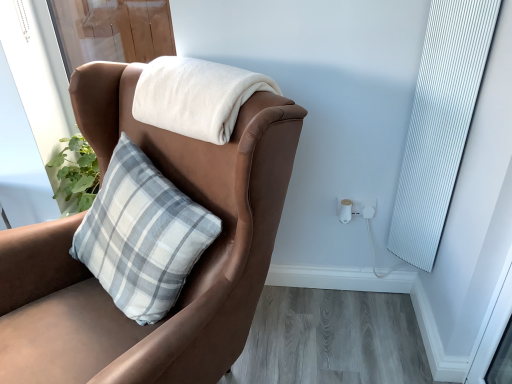
Question: Considering the relative sizes of white soft blanket at upper center and white plastic electric outlet at lower right in the image provided, is white soft blanket at upper center thinner than white plastic electric outlet at lower right?

Choices:
 (A) yes
 (B) no

Answer: (B)

Question: Is white soft blanket at upper center aimed at white plastic electric outlet at lower right?

Choices:
 (A) no
 (B) yes

Answer: (A)

Question: Considering the relative sizes of white soft blanket at upper center and white plastic electric outlet at lower right in the image provided, is white soft blanket at upper center shorter than white plastic electric outlet at lower right?

Choices:
 (A) yes
 (B) no

Answer: (B)

Question: Would you say white soft blanket at upper center contains white plastic electric outlet at lower right?

Choices:
 (A) yes
 (B) no

Answer: (B)

Question: From the image's perspective, is white soft blanket at upper center on white plastic electric outlet at lower right?

Choices:
 (A) yes
 (B) no

Answer: (A)

Question: Is brown leather chair at upper left wider or thinner than white plastic electric outlet at lower right?

Choices:
 (A) thin
 (B) wide

Answer: (B)

Question: Considering the positions of point (75, 329) and point (353, 213), is point (75, 329) closer or farther from the camera than point (353, 213)?

Choices:
 (A) farther
 (B) closer

Answer: (B)

Question: Considering the positions of brown leather chair at upper left and white plastic electric outlet at lower right in the image, is brown leather chair at upper left taller or shorter than white plastic electric outlet at lower right?

Choices:
 (A) short
 (B) tall

Answer: (B)

Question: Based on their sizes in the image, would you say brown leather chair at upper left is bigger or smaller than white plastic electric outlet at lower right?

Choices:
 (A) small
 (B) big

Answer: (B)

Question: Is white soft blanket at upper center taller or shorter than brown leather chair at upper left?

Choices:
 (A) short
 (B) tall

Answer: (A)

Question: Considering the positions of white soft blanket at upper center and brown leather chair at upper left in the image, is white soft blanket at upper center wider or thinner than brown leather chair at upper left?

Choices:
 (A) thin
 (B) wide

Answer: (A)

Question: From a real-world perspective, is white soft blanket at upper center above or below brown leather chair at upper left?

Choices:
 (A) below
 (B) above

Answer: (B)

Question: Considering their positions, is white soft blanket at upper center located in front of or behind brown leather chair at upper left?

Choices:
 (A) behind
 (B) front

Answer: (A)

Question: Is white ribbed curtain at right inside the boundaries of white plastic electric outlet at lower right, or outside?

Choices:
 (A) inside
 (B) outside

Answer: (B)

Question: Is point (452, 13) positioned closer to the camera than point (342, 210)?

Choices:
 (A) farther
 (B) closer

Answer: (B)